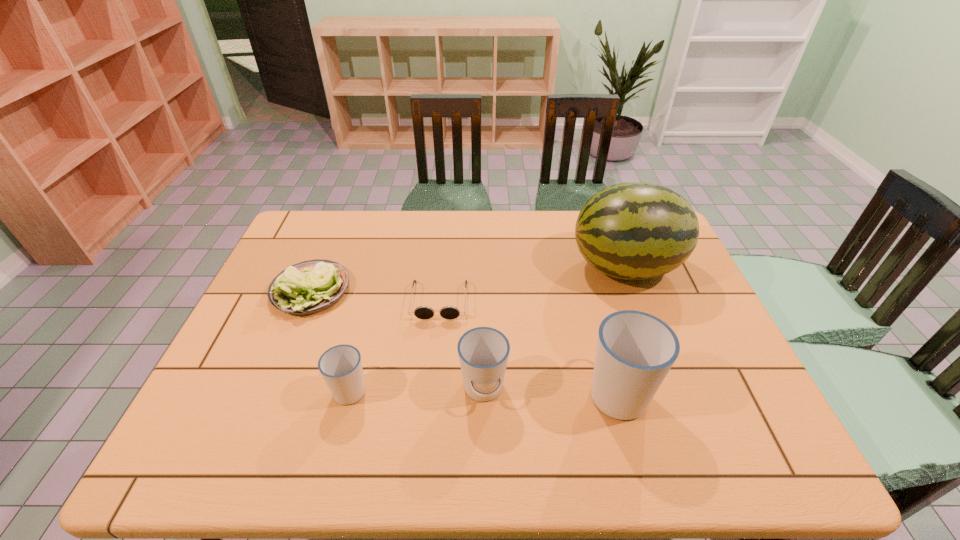
Locate an element on the screen. free space between the leftmost cup and the second tallest cup is located at coordinates (417, 389).

You are a GUI agent. You are given a task and a screenshot of the screen. Output one action in this format:
    pyautogui.click(x=<x>, y=<y>)
    Task: Click on the vacant region between the shortest object and the rightmost cup
    
    Given the screenshot: What is the action you would take?
    pyautogui.click(x=528, y=346)

Identify the location of free space between the fifth tallest object and the watermelon. The width and height of the screenshot is (960, 540). (468, 279).

Locate an element on the screen. empty space between the second tallest object and the third tallest object is located at coordinates (550, 390).

Find the location of a particular element. The image size is (960, 540). free space between the second cup from left to right and the third shortest object is located at coordinates (417, 389).

Find the location of `free space between the watermelon and the fifth tallest object`. free space between the watermelon and the fifth tallest object is located at coordinates (468, 279).

Identify the location of free point between the sunglasses and the fifth tallest object. (375, 296).

The image size is (960, 540). What are the coordinates of `object that ranks as the closest to the fifth object from right to left` in the screenshot? It's located at (309, 287).

Point out which object is positioned as the fifth nearest to the tallest cup. Please provide its 2D coordinates. Your answer should be formatted as a tuple, i.e. [(x, y)], where the tuple contains the x and y coordinates of a point satisfying the conditions above.

[(309, 287)]

Locate an element on the screen. The width and height of the screenshot is (960, 540). cup that stands as the third closest to the second shortest object is located at coordinates (635, 350).